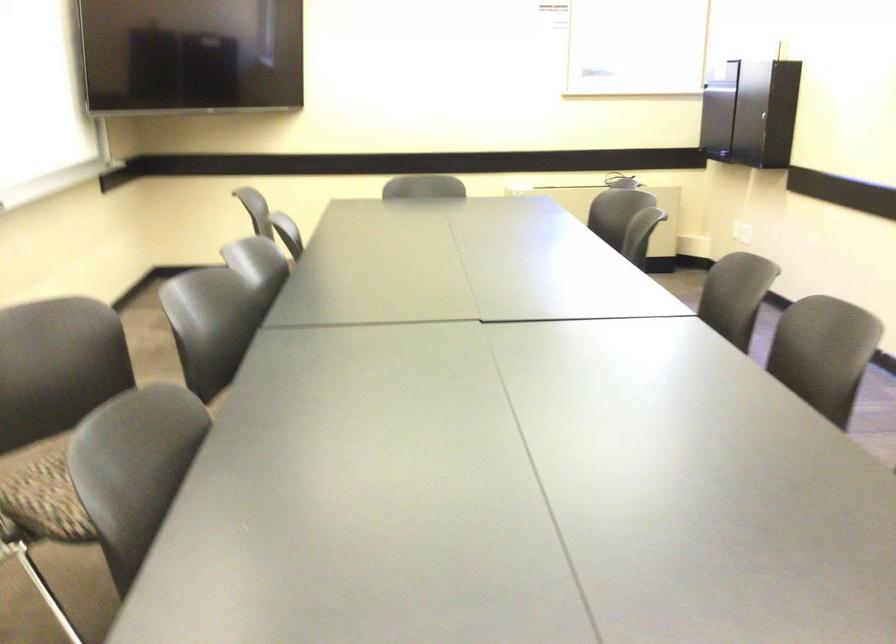
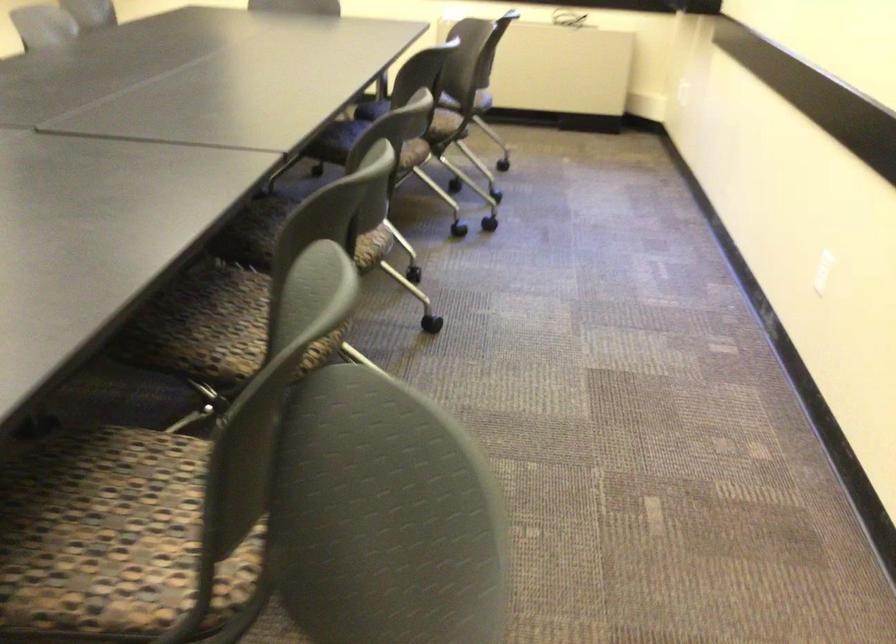
Question: What movement of the cameraman would produce the second image?

Choices:
 (A) Left
 (B) Right
 (C) Forward
 (D) Backward

Answer: (B)